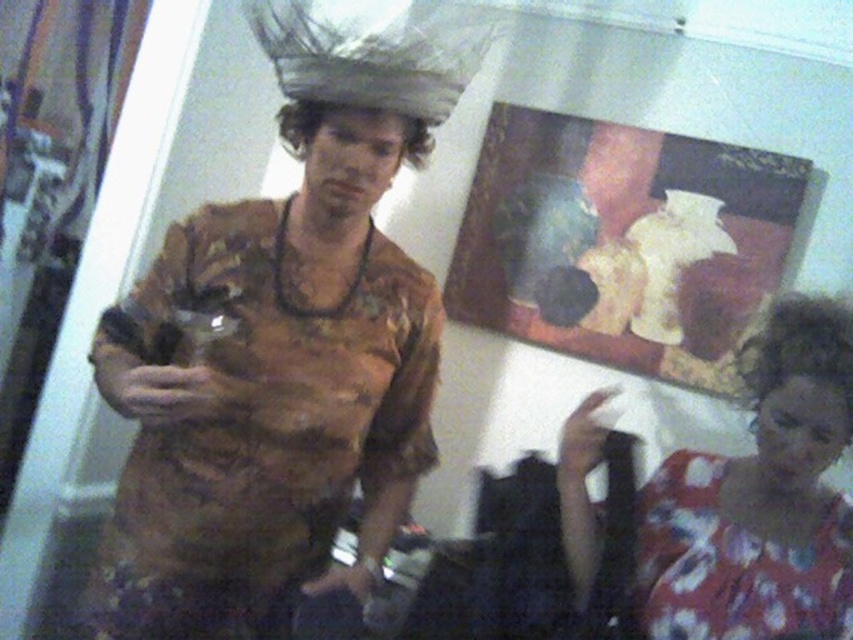
Based on the photo, based on the scene described, is the curly brown hair at lower right located to the right or left of the shiny metallic headband at center?

The curly brown hair at lower right is located to the right of the shiny metallic headband at center.

You are a photographer trying to adjust the focus of your camera to capture both the matte brown shirt at center and the curly brown hair at lower right clearly. Given that your camera has a depth of field that can cover 25 inches, will both subjects be in focus?

The distance between the matte brown shirt at center and the curly brown hair at lower right is 25.76 inches. Since the camera can only cover 25 inches, the focus will not cover both subjects. The photographer will need to adjust the focus or use a different setting to ensure both are in focus.